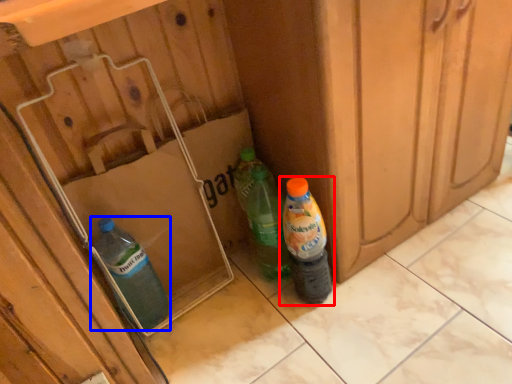
Question: Among these objects, which one is nearest to the camera, bottle (highlighted by a red box) or bottle (highlighted by a blue box)?

Choices:
 (A) bottle
 (B) bottle

Answer: (A)